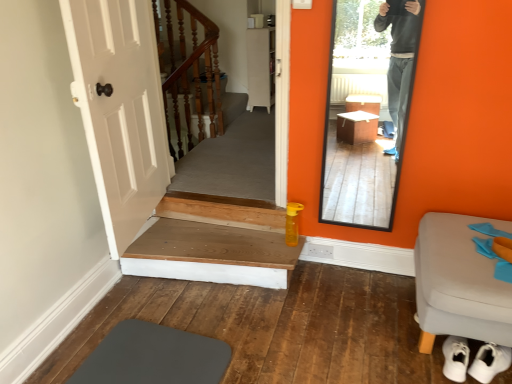
Find the location of a particular element. free space in front of wooden at bottom, the 1th stairs when ordered from front to back is located at coordinates (212, 337).